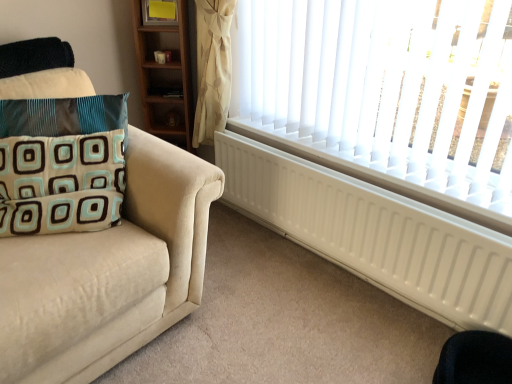
The width and height of the screenshot is (512, 384). Describe the element at coordinates (475, 359) in the screenshot. I see `black fabric swivel chair at lower right` at that location.

In order to click on black fabric swivel chair at lower right in this screenshot , I will do click(x=475, y=359).

Does white matte radiator at lower right lie behind black fabric swivel chair at lower right?

That is True.

At what (x,y) coordinates should I click in order to perform the action: click on radiator behind the black fabric swivel chair at lower right. Please return your answer as a coordinate pair (x, y). Looking at the image, I should click on (375, 234).

Between white matte radiator at lower right and black fabric swivel chair at lower right, which one appears on the left side from the viewer's perspective?

white matte radiator at lower right.

Would you say white matte radiator at lower right is outside black fabric swivel chair at lower right?

Yes.

Which object is positioned more to the left, white matte radiator at lower right or teal velvet pillow at left?

Positioned to the left is teal velvet pillow at left.

Is white matte radiator at lower right not inside teal velvet pillow at left?

That's correct, white matte radiator at lower right is outside of teal velvet pillow at left.

Is white matte radiator at lower right positioned behind teal velvet pillow at left?

Yes, it is.

Considering the sizes of objects white matte radiator at lower right and teal velvet pillow at left in the image provided, who is bigger, white matte radiator at lower right or teal velvet pillow at left?

white matte radiator at lower right.

Is black fabric swivel chair at lower right outside of white matte radiator at lower right?

Absolutely, black fabric swivel chair at lower right is external to white matte radiator at lower right.

From a real-world perspective, does black fabric swivel chair at lower right sit lower than white matte radiator at lower right?

Correct, in the physical world, black fabric swivel chair at lower right is lower than white matte radiator at lower right.

Consider the image. Which object is further away from the camera, black fabric swivel chair at lower right or white matte radiator at lower right?

white matte radiator at lower right is behind.

Is black fabric swivel chair at lower right far away from white matte radiator at lower right?

No.

Could you tell me if teal velvet pillow at left is facing white matte radiator at lower right?

No.

From a real-world perspective, is teal velvet pillow at left positioned under white matte radiator at lower right based on gravity?

No, from a real-world perspective, teal velvet pillow at left is not below white matte radiator at lower right.

Identify the location of pillow above the white matte radiator at lower right (from a real-world perspective). (62, 164).

Where is `swivel chair below the teal velvet pillow at left (from the image's perspective)`? This screenshot has width=512, height=384. swivel chair below the teal velvet pillow at left (from the image's perspective) is located at coordinates (475, 359).

Is black fabric swivel chair at lower right positioned with its back to teal velvet pillow at left?

black fabric swivel chair at lower right does not have its back to teal velvet pillow at left.

From the image's perspective, is black fabric swivel chair at lower right on teal velvet pillow at left?

No.

Which is behind, point (435, 370) or point (87, 227)?

Point (435, 370)

Can you confirm if teal velvet pillow at left is wider than black fabric swivel chair at lower right?

In fact, teal velvet pillow at left might be narrower than black fabric swivel chair at lower right.

Who is shorter, teal velvet pillow at left or black fabric swivel chair at lower right?

With less height is black fabric swivel chair at lower right.

In the scene shown: Can you confirm if teal velvet pillow at left is positioned to the right of black fabric swivel chair at lower right?

No.

Locate an element on the screen. This screenshot has height=384, width=512. swivel chair located below the white matte radiator at lower right (from the image's perspective) is located at coordinates (475, 359).

Where is `pillow lying above the white matte radiator at lower right (from the image's perspective)`? pillow lying above the white matte radiator at lower right (from the image's perspective) is located at coordinates (62, 164).

Based on the photo, looking at the image, which one is located closer to black fabric swivel chair at lower right, white matte radiator at lower right or teal velvet pillow at left?

Based on the image, white matte radiator at lower right appears to be nearer to black fabric swivel chair at lower right.

From the image, which object appears to be farther from black fabric swivel chair at lower right, teal velvet pillow at left or white matte radiator at lower right?

teal velvet pillow at left is further to black fabric swivel chair at lower right.

From the picture: Looking at the image, which one is located closer to teal velvet pillow at left, black fabric swivel chair at lower right or white matte radiator at lower right?

white matte radiator at lower right.

From the image, which object appears to be farther from teal velvet pillow at left, white matte radiator at lower right or black fabric swivel chair at lower right?

black fabric swivel chair at lower right is further to teal velvet pillow at left.

Based on the photo, from the image, which object appears to be farther from white matte radiator at lower right, teal velvet pillow at left or black fabric swivel chair at lower right?

teal velvet pillow at left is further to white matte radiator at lower right.

Estimate the real-world distances between objects in this image. Which object is closer to white matte radiator at lower right, black fabric swivel chair at lower right or teal velvet pillow at left?

Among the two, black fabric swivel chair at lower right is located nearer to white matte radiator at lower right.

Locate an element on the screen. Image resolution: width=512 pixels, height=384 pixels. radiator between teal velvet pillow at left and black fabric swivel chair at lower right is located at coordinates (375, 234).